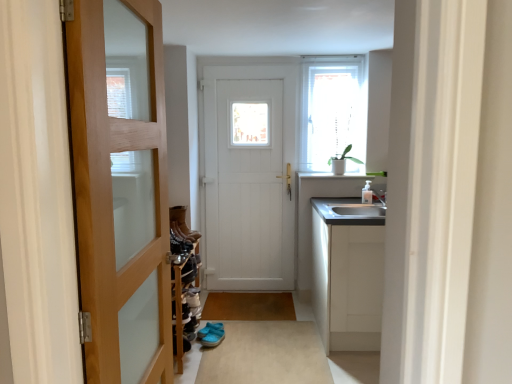
Where is `free spot above white wooden door at center, the second door from the front (from a real-world perspective)`? free spot above white wooden door at center, the second door from the front (from a real-world perspective) is located at coordinates (253, 59).